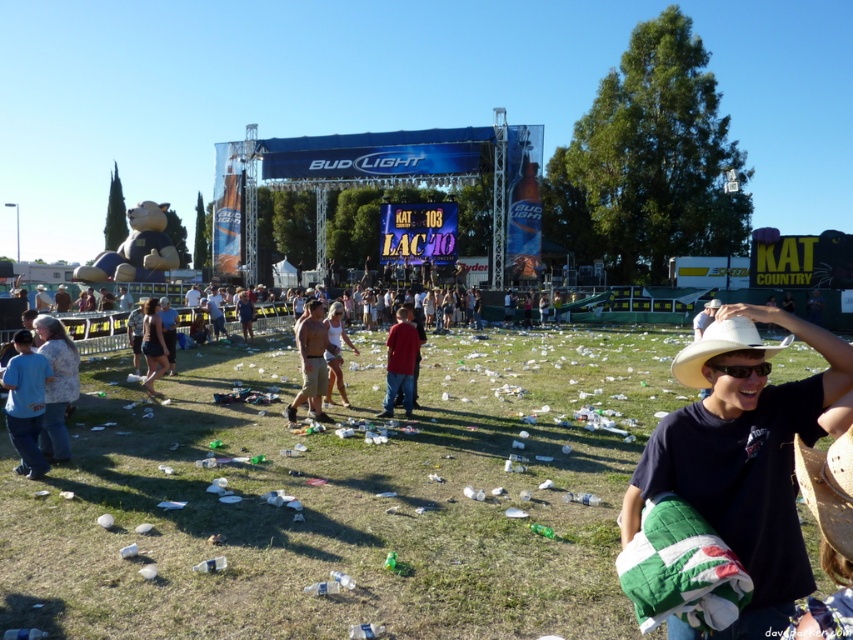
Question: From the image, what is the correct spatial relationship of matte red shirt at center in relation to matte white tank top at center?

Choices:
 (A) below
 (B) above

Answer: (A)

Question: Considering the real-world distances, which object is closest to the green grass at center?

Choices:
 (A) matte white tank top at center
 (B) tan cotton shorts at center
 (C) light brown leather jacket at center

Answer: (A)

Question: Which point is farther from the camera taking this photo?

Choices:
 (A) (701, 346)
 (B) (280, 472)
 (C) (836, 403)
 (D) (213, 323)

Answer: (D)

Question: Which point appears farthest from the camera in this image?

Choices:
 (A) (740, 328)
 (B) (50, 362)

Answer: (B)

Question: Is light brown hair at center closer to camera compared to black plastic goggles at center?

Choices:
 (A) yes
 (B) no

Answer: (B)

Question: Is white matte cowboy hat at center wider than light brown hair at center?

Choices:
 (A) no
 (B) yes

Answer: (B)